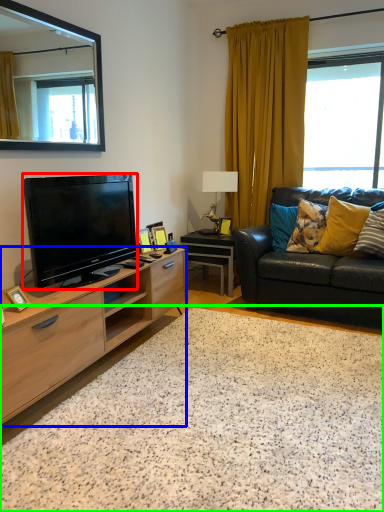
Question: Estimate the real-world distances between objects in this image. Which object is closer to television (highlighted by a red box), cabinetry (highlighted by a blue box) or granite (highlighted by a green box)?

Choices:
 (A) cabinetry
 (B) granite

Answer: (A)